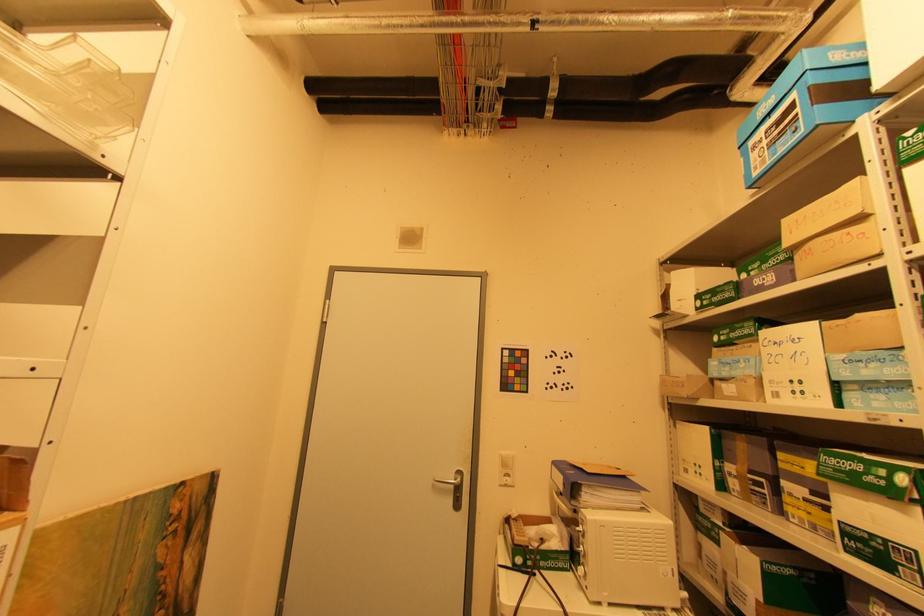
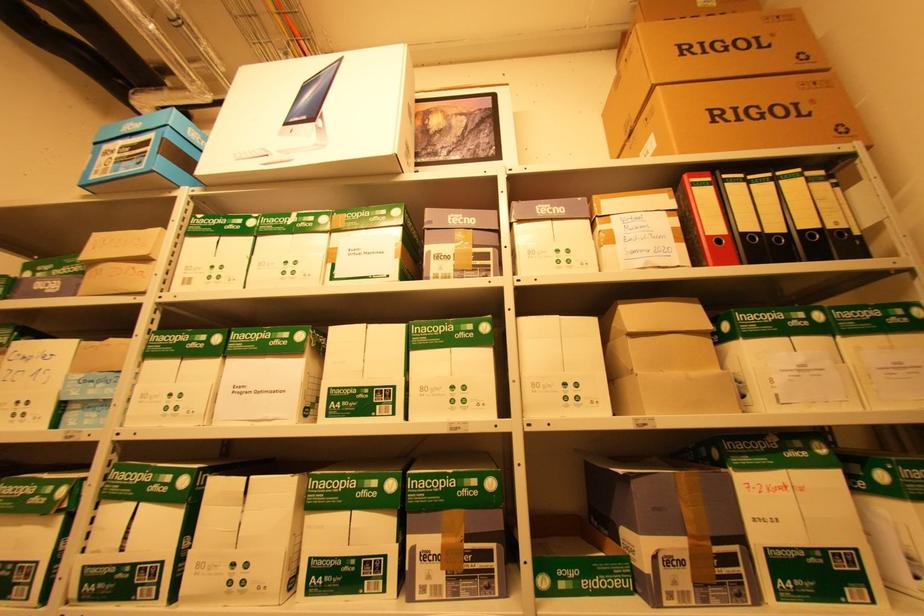
Question: Based on the continuous images, in which direction is the camera rotating? Reply with the corresponding letter.

Choices:
 (A) Left
 (B) Right
 (C) Up
 (D) Down

Answer: (B)